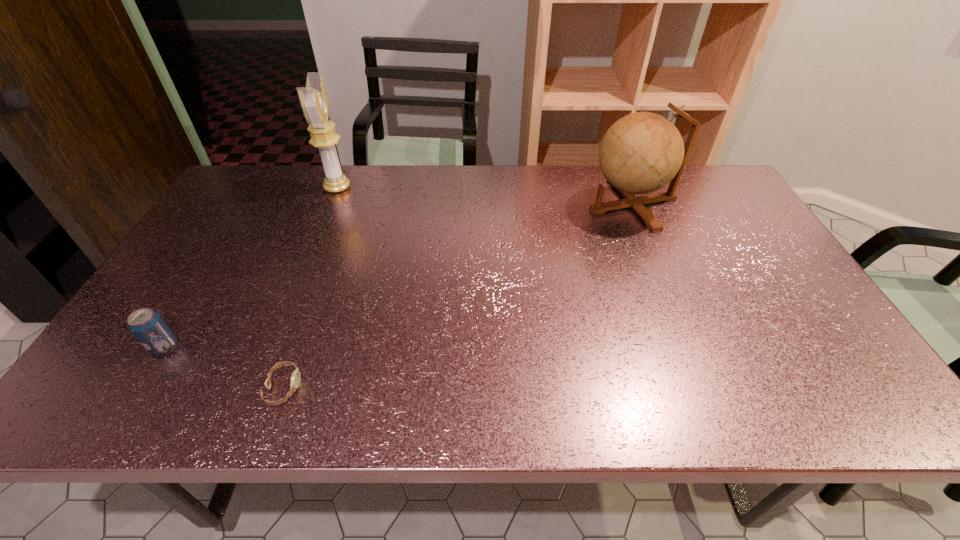
Find the location of `empty location between the shortest object and the globe`. empty location between the shortest object and the globe is located at coordinates (458, 296).

Locate an element on the screen. This screenshot has height=540, width=960. vacant region between the award and the globe is located at coordinates (485, 196).

Locate an element on the screen. vacant area between the second shortest object and the globe is located at coordinates (398, 275).

This screenshot has height=540, width=960. What are the coordinates of `empty space between the nearest object and the globe` in the screenshot? It's located at (458, 296).

At what (x,y) coordinates should I click in order to perform the action: click on empty location between the rightmost object and the pop soda. Please return your answer as a coordinate pair (x, y). This screenshot has height=540, width=960. Looking at the image, I should click on (398, 275).

Find the location of `vacant point located between the globe and the leftmost object`. vacant point located between the globe and the leftmost object is located at coordinates (398, 275).

Locate an element on the screen. This screenshot has height=540, width=960. vacant area between the third tallest object and the award is located at coordinates (251, 267).

Locate an element on the screen. This screenshot has height=540, width=960. vacant space that is in between the award and the watch is located at coordinates (310, 288).

You are a GUI agent. You are given a task and a screenshot of the screen. Output one action in this format:
    pyautogui.click(x=<x>, y=<y>)
    Task: Click on the unoccupied area between the rightmost object and the watch
    
    Given the screenshot: What is the action you would take?
    pyautogui.click(x=458, y=296)

Image resolution: width=960 pixels, height=540 pixels. Identify the location of free space between the second shortest object and the nearest object. (224, 367).